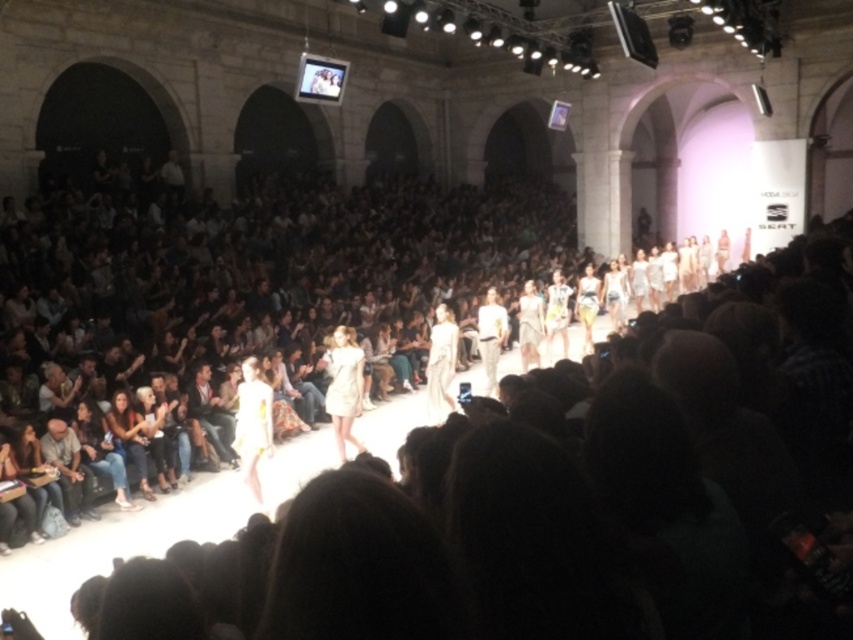
Does jeans at lower left have a lesser height compared to white cotton shirt at center?

Yes.

Locate an element on the screen. jeans at lower left is located at coordinates (102, 449).

Does white matte dress at center appear on the right side of white cotton shirt at center?

Incorrect, white matte dress at center is not on the right side of white cotton shirt at center.

Where is `white matte dress at center`? The width and height of the screenshot is (853, 640). white matte dress at center is located at coordinates (344, 387).

From the picture: Who is taller, jeans at lower left or light brown leather jacket at lower left?

With more height is light brown leather jacket at lower left.

This screenshot has height=640, width=853. What do you see at coordinates (102, 449) in the screenshot?
I see `jeans at lower left` at bounding box center [102, 449].

At what (x,y) coordinates should I click in order to perform the action: click on jeans at lower left. Please return your answer as a coordinate pair (x, y). This screenshot has width=853, height=640. Looking at the image, I should click on (102, 449).